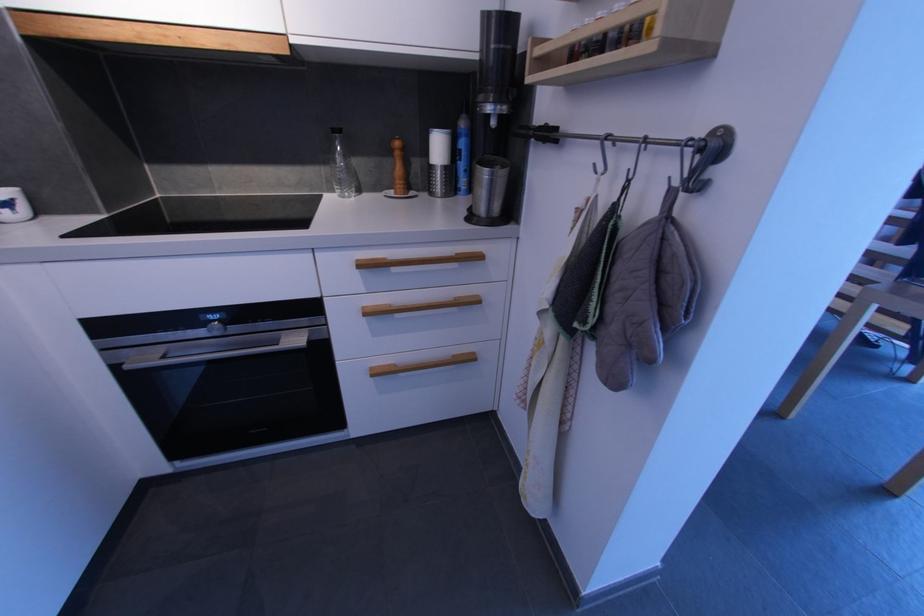
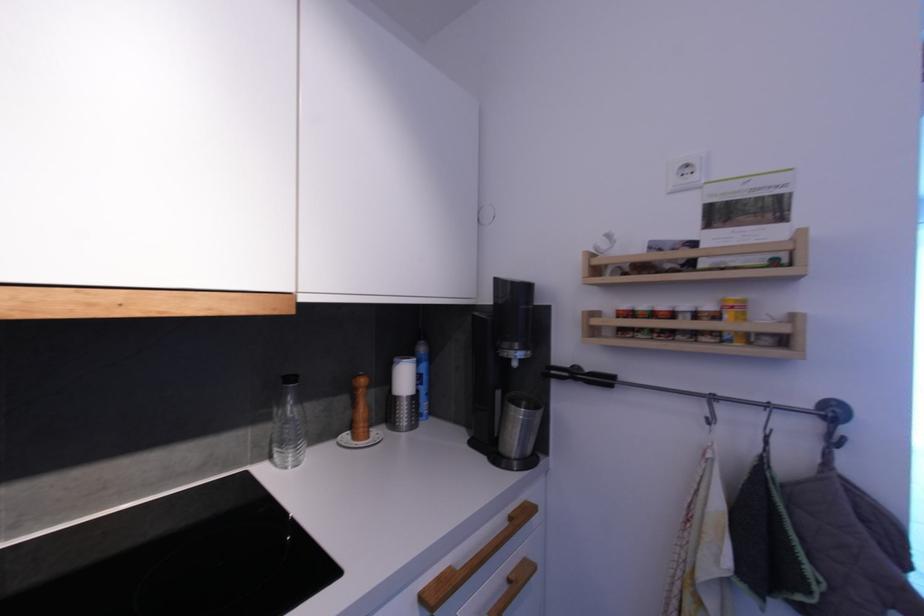
Where in the second image is the point corresponding to the point at 480,302 from the first image?

(532, 570)